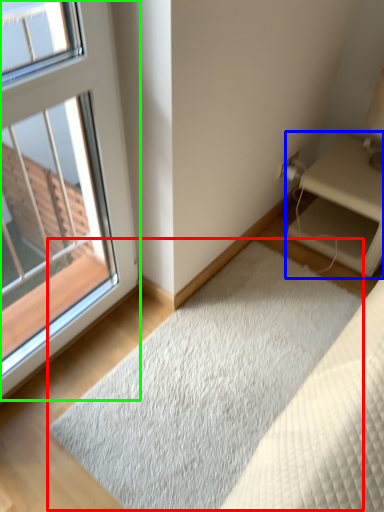
Question: Which is farther away from doormat (highlighted by a red box)? nightstand (highlighted by a blue box) or window (highlighted by a green box)?

Choices:
 (A) nightstand
 (B) window

Answer: (B)